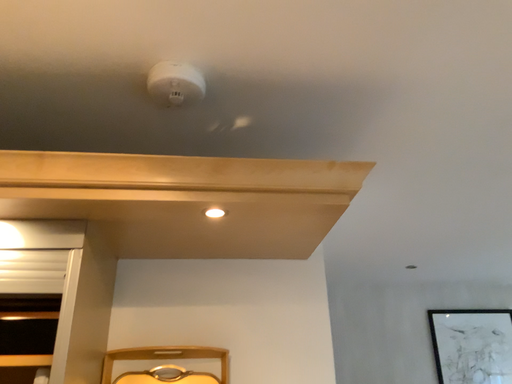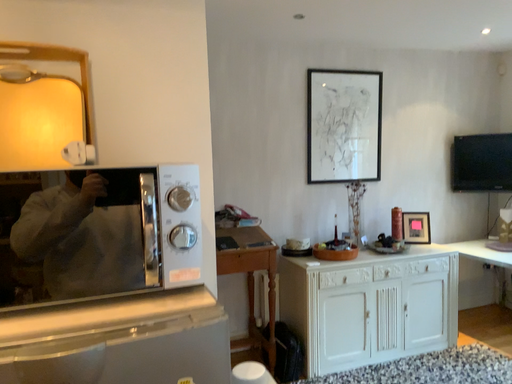
Question: How did the camera likely rotate when shooting the video?

Choices:
 (A) rotated right
 (B) rotated left

Answer: (A)